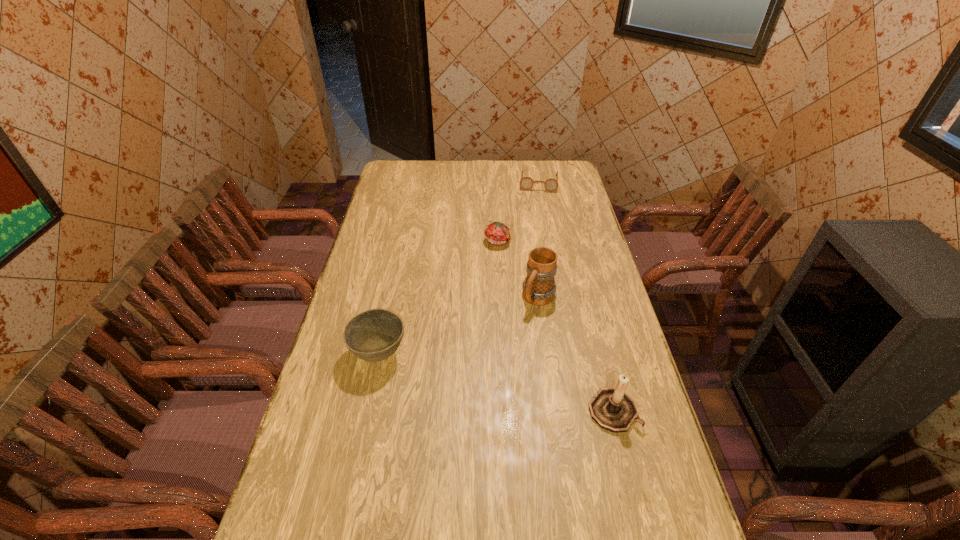
You are a GUI agent. You are given a task and a screenshot of the screen. Output one action in this format:
    pyautogui.click(x=<x>, y=<y>)
    Task: Click on the object that is at the left edge
    This screenshot has width=960, height=540.
    Given the screenshot: What is the action you would take?
    pyautogui.click(x=373, y=335)

Image resolution: width=960 pixels, height=540 pixels. I want to click on candle holder that is at the right edge, so (613, 409).

Identify the location of spectacles that is at the right edge. This screenshot has height=540, width=960. (526, 183).

Where is `object that is at the far right corner`? The width and height of the screenshot is (960, 540). object that is at the far right corner is located at coordinates (526, 183).

Locate an element on the screen. This screenshot has height=540, width=960. free region at the far edge of the desktop is located at coordinates (486, 168).

The image size is (960, 540). In order to click on free space at the near edge of the desktop in this screenshot , I will do `click(599, 527)`.

Locate an element on the screen. free region at the left edge of the desktop is located at coordinates (360, 264).

In the image, there is a desktop. Where is `vacant space at the right edge`? vacant space at the right edge is located at coordinates (562, 199).

Locate an element on the screen. vacant space at the far left corner of the desktop is located at coordinates (390, 168).

In the image, there is a desktop. Where is `blank space at the far right corner`? This screenshot has height=540, width=960. blank space at the far right corner is located at coordinates (565, 161).